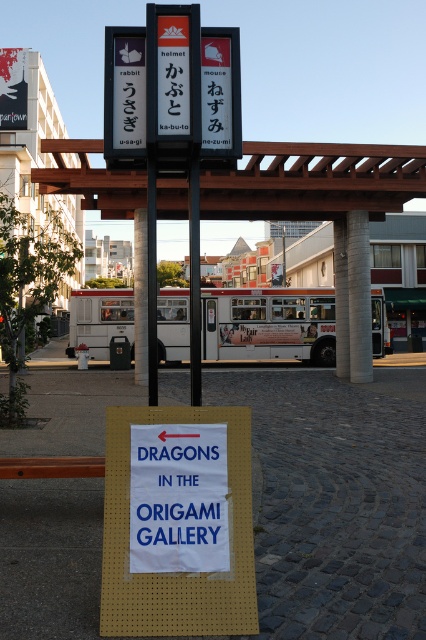
Who is lower down, wooden signpost at center or white paper sign at center?

white paper sign at center is lower down.

Can you confirm if wooden signpost at center is bigger than white paper sign at center?

Yes.

This screenshot has height=640, width=426. What do you see at coordinates (314, 180) in the screenshot?
I see `wooden signpost at center` at bounding box center [314, 180].

You are a GUI agent. You are given a task and a screenshot of the screen. Output one action in this format:
    pyautogui.click(x=<x>, y=<y>)
    Task: Click on the wooden signpost at center
    
    Given the screenshot: What is the action you would take?
    pyautogui.click(x=314, y=180)

Which is below, white matte bus at center or blue paper sign at center?

blue paper sign at center is below.

Looking at this image, between white matte bus at center and blue paper sign at center, which one is positioned higher?

white matte bus at center is above.

Between point (86, 304) and point (131, 449), which one is positioned in front?

Positioned in front is point (131, 449).

Where is `white matte bus at center`? Image resolution: width=426 pixels, height=640 pixels. white matte bus at center is located at coordinates (270, 324).

Between point (146, 412) and point (373, 307), which one is positioned in front?

Positioned in front is point (146, 412).

Looking at this image, does white paper sign at center have a larger size compared to white matte bus at center?

No.

Locate an element on the screen. white paper sign at center is located at coordinates click(175, 572).

This screenshot has height=640, width=426. I want to click on white paper sign at center, so click(175, 572).